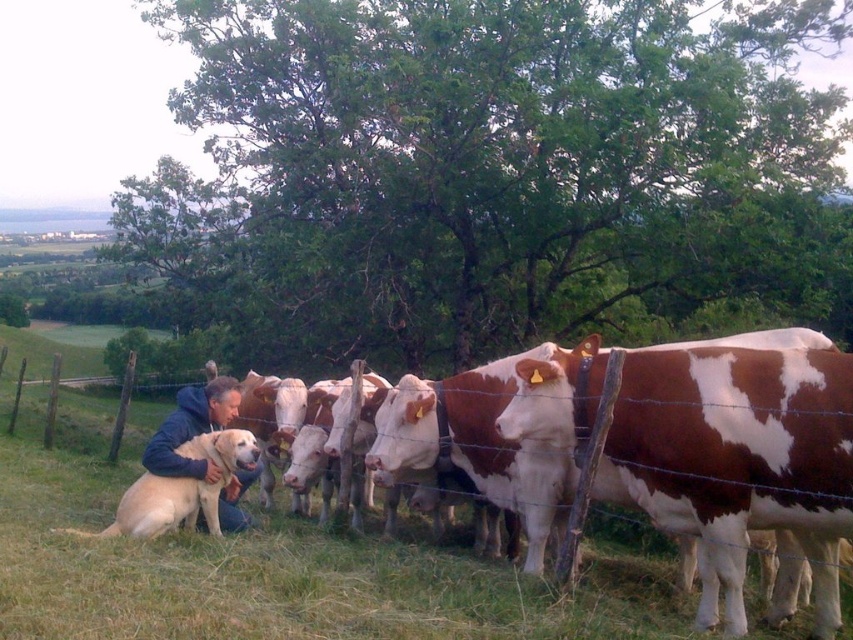
You are a photographer trying to capture a photo of the golden fur dog at lower left and the golden fur dog at center. Since you want both dogs in the frame, which direction should you move your camera to include both?

Since the golden fur dog at lower left is to the left of golden fur dog at center, you should move your camera to the left to include both dogs in the frame.

You are standing at the origin point in the image. The golden fur dog at lower left is located at point (180, 490). Can you determine the direction to walk to reach the golden fur dog at lower left?

The golden fur dog at lower left is located at point (180, 490), which is to the lower left direction from the origin point.